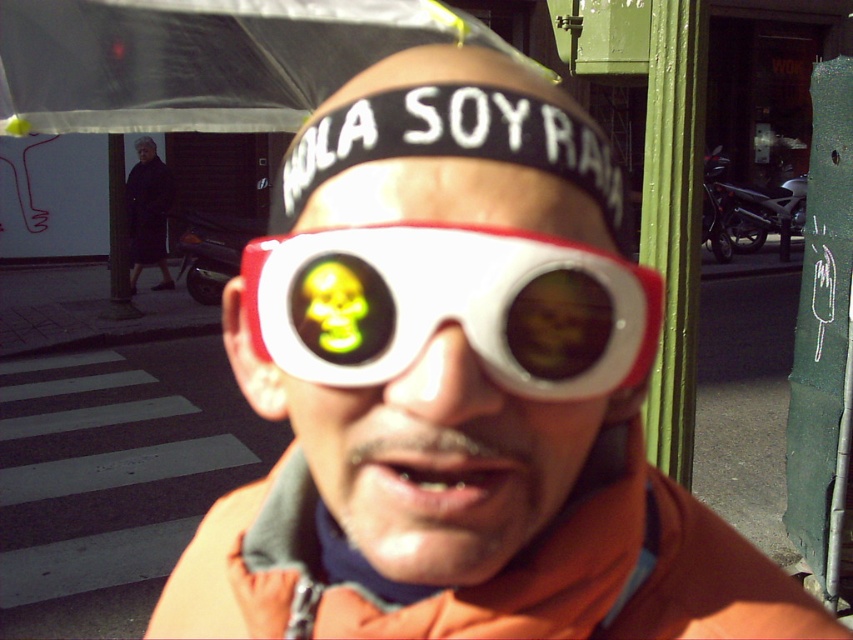
You are a photographer trying to capture a closeup of the person in the scene. You notice the brown matte eye at center and the matte black sunglasses at center. Which object should you focus on if you want to highlight the smaller one in your photo?

The brown matte eye at center has a smaller size compared to the matte black sunglasses at center, so you should focus on the brown matte eye at center to highlight the smaller one.